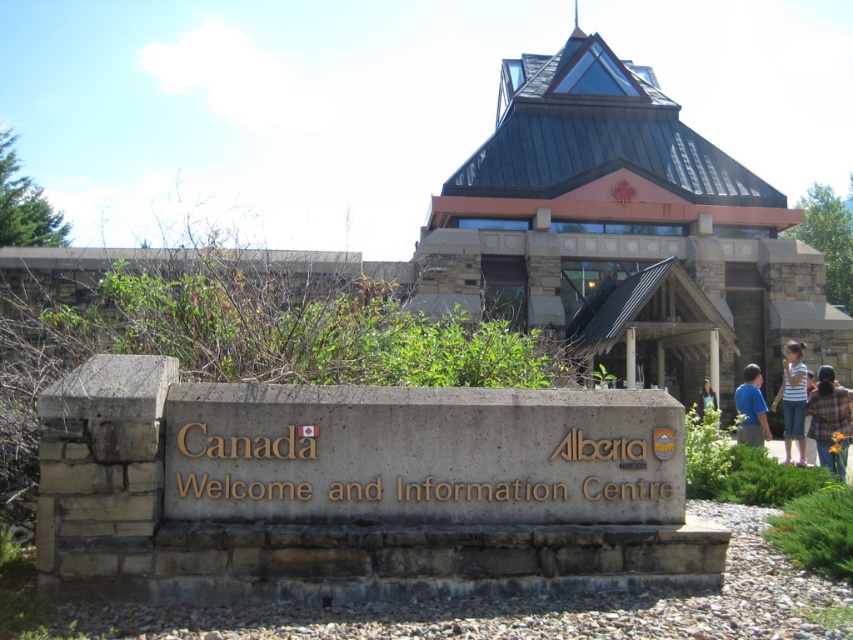
You are a visitor at the Canada Alberta Welcome and Information Centre and see two people wearing a plaid shirt at center and a blue shirt at right. Which shirt is closer to you?

The plaid shirt at center is closer to you because it is in front of the blue shirt at right.